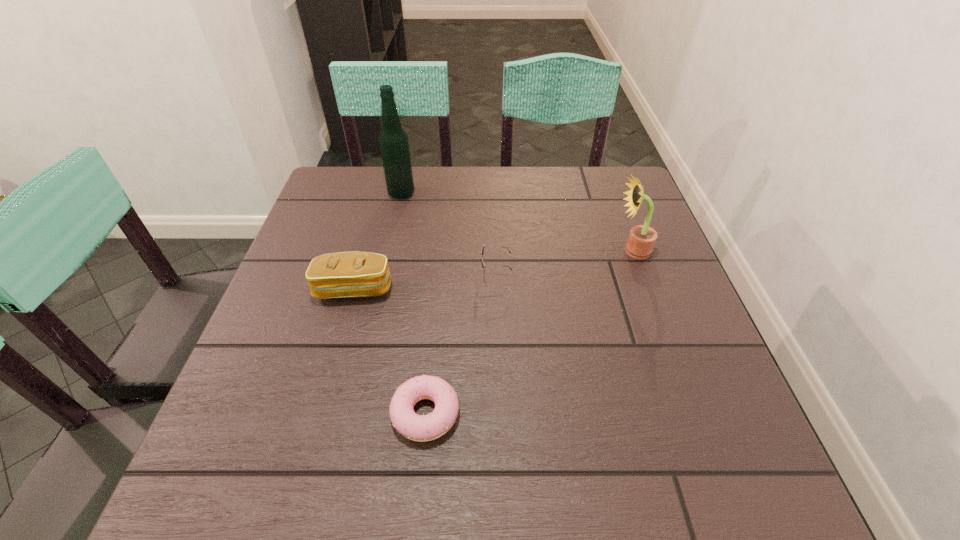
Where is `vacant space situated on the face of the sunflower`? This screenshot has height=540, width=960. vacant space situated on the face of the sunflower is located at coordinates (572, 251).

Locate an element on the screen. The image size is (960, 540). vacant space located 0.340m on the face of the sunflower is located at coordinates (470, 251).

At what (x,y) coordinates should I click in order to perform the action: click on vacant area situated 0.070m on the zipper side of the clutch bag. Please return your answer as a coordinate pair (x, y). Looking at the image, I should click on (342, 332).

Where is `free region located in front of the lenses of the sunglasses`? The image size is (960, 540). free region located in front of the lenses of the sunglasses is located at coordinates (408, 274).

Locate an element on the screen. This screenshot has width=960, height=540. free space located 0.250m in front of the lenses of the sunglasses is located at coordinates (369, 274).

The image size is (960, 540). In order to click on vacant region located in front of the lenses of the sunglasses in this screenshot , I will do `click(306, 274)`.

This screenshot has width=960, height=540. Identify the location of free space located on the back of the shortest object. (438, 287).

Find the location of a particular element. object positioned at the far edge is located at coordinates (393, 140).

This screenshot has width=960, height=540. I want to click on object located in the left edge section of the desktop, so click(344, 274).

Locate an element on the screen. object that is positioned at the right edge is located at coordinates (641, 240).